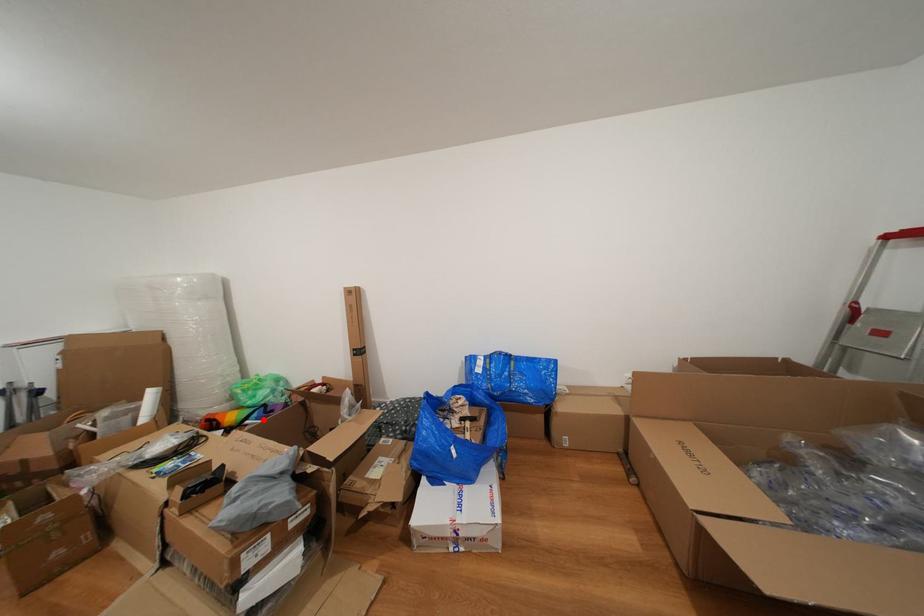
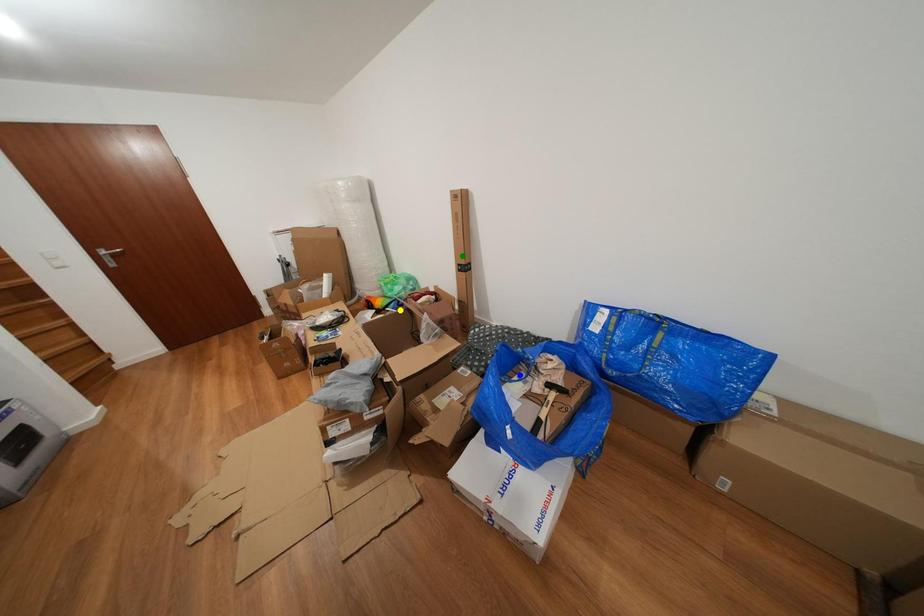
Question: I am providing you with two images of the same scene from different viewpoints. A red point is marked on the first image. You are given multiple points on the second image. Which point in image 2 represents the same 3d spot as the red point in image 1?

Choices:
 (A) green point
 (B) blue point
 (C) yellow point

Answer: (C)